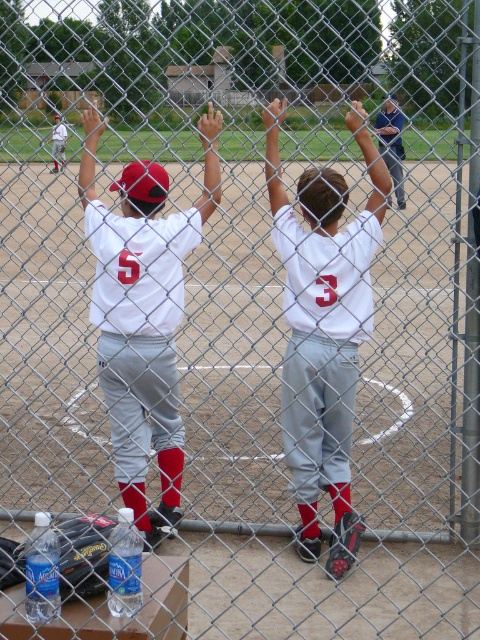
Question: Does white matte jersey at center have a smaller size compared to white jersey at center?

Choices:
 (A) yes
 (B) no

Answer: (B)

Question: Does white matte jersey at center have a lesser width compared to white jersey at center?

Choices:
 (A) no
 (B) yes

Answer: (A)

Question: Which of the following is the farthest from the observer?

Choices:
 (A) (153, 273)
 (B) (269, 136)

Answer: (A)

Question: Which of the following is the closest to the observer?

Choices:
 (A) (110, 387)
 (B) (295, 442)

Answer: (B)

Question: Which point appears closest to the camera in this image?

Choices:
 (A) (277, 237)
 (B) (115, 406)

Answer: (A)

Question: Is white matte jersey at center to the right of white jersey at center from the viewer's perspective?

Choices:
 (A) no
 (B) yes

Answer: (B)